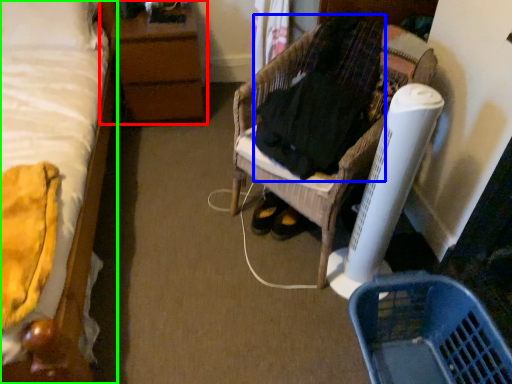
Question: Based on their relative distances, which object is farther from nightstand (highlighted by a red box)? Choose from clothing (highlighted by a blue box) and bed (highlighted by a green box).

Choices:
 (A) clothing
 (B) bed

Answer: (A)